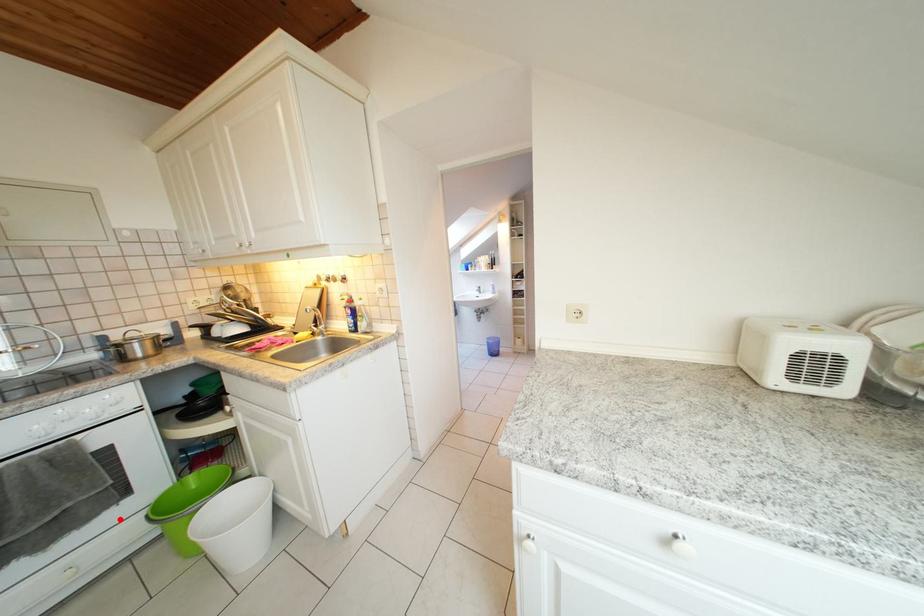
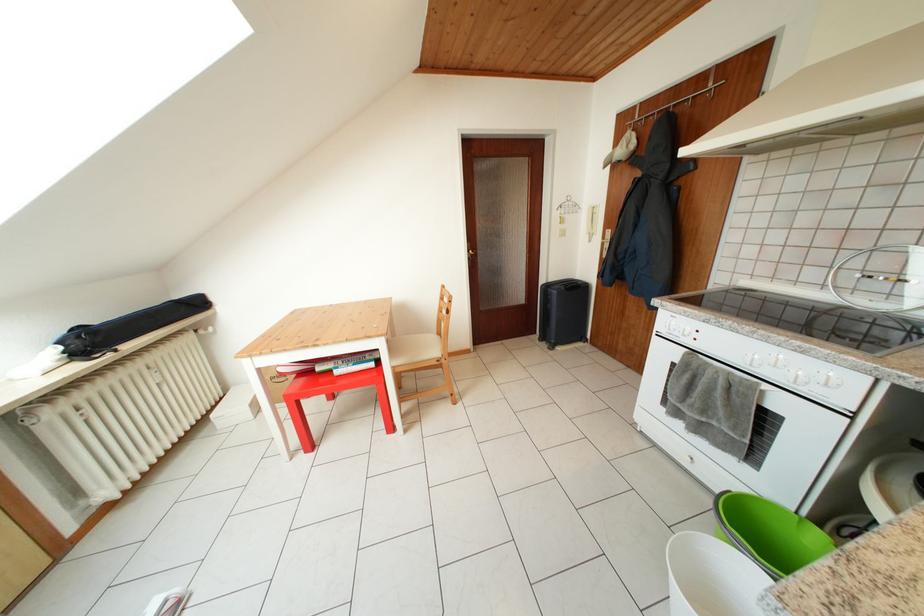
Locate, in the second image, the point that corresponds to the highlighted location in the first image.

(738, 467)